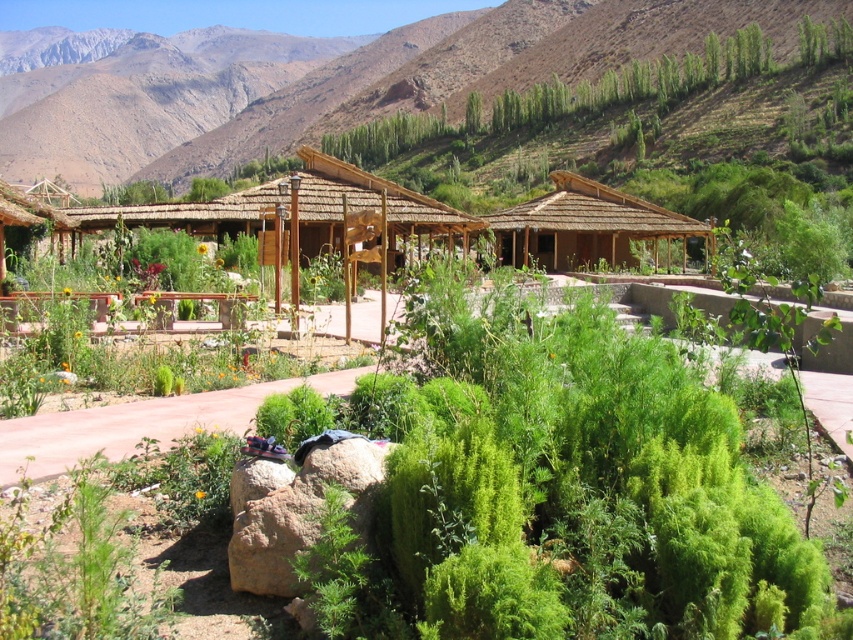
Question: Estimate the real-world distances between objects in this image. Which object is closer to the brown thatched hut at center?

Choices:
 (A) thatched straw hut at center
 (B) brown rough boulder at lower center

Answer: (A)

Question: Among these points, which one is farthest from the camera?

Choices:
 (A) (239, 580)
 (B) (450, 244)
 (C) (656, 228)

Answer: (C)

Question: Which of the following is the farthest from the observer?

Choices:
 (A) [x=300, y=516]
 (B) [x=384, y=188]
 (C) [x=676, y=227]

Answer: (C)

Question: Can you confirm if brown thatched hut at center is positioned to the right of thatched straw hut at center?

Choices:
 (A) yes
 (B) no

Answer: (A)

Question: Can you confirm if brown rough boulder at lower center is thinner than thatched straw hut at center?

Choices:
 (A) no
 (B) yes

Answer: (B)

Question: Is brown thatched hut at center to the left of thatched straw hut at center from the viewer's perspective?

Choices:
 (A) no
 (B) yes

Answer: (A)